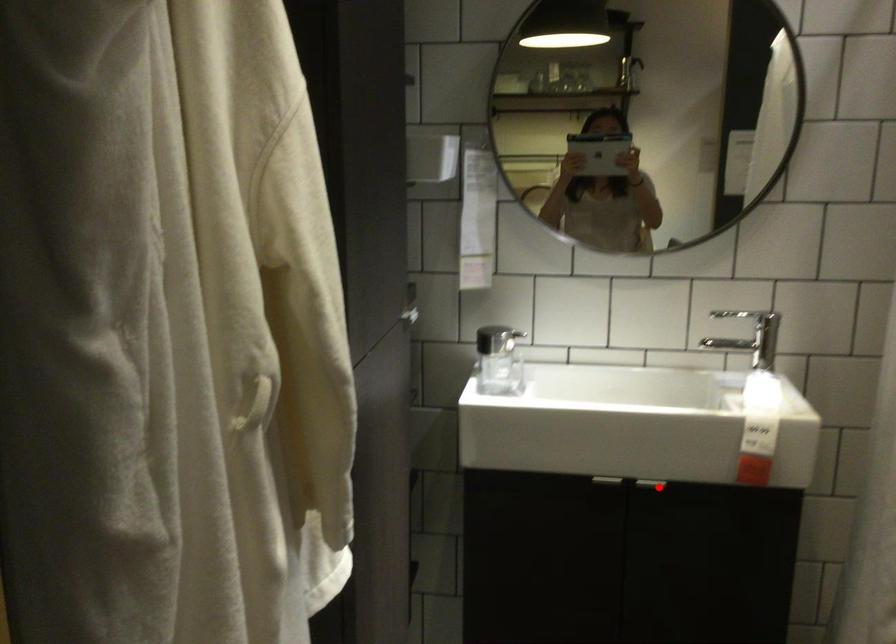
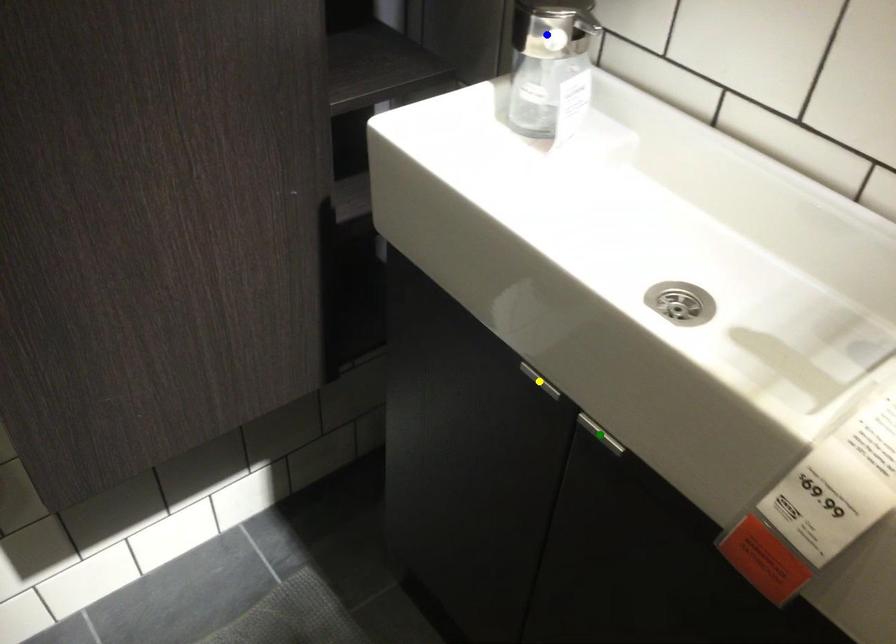
Question: I am providing you with two images of the same scene from different viewpoints. A red point is marked on the first image. You are given multiple points on the second image. Which point in image 2 represents the same 3d spot as the red point in image 1?

Choices:
 (A) green point
 (B) blue point
 (C) yellow point

Answer: (A)